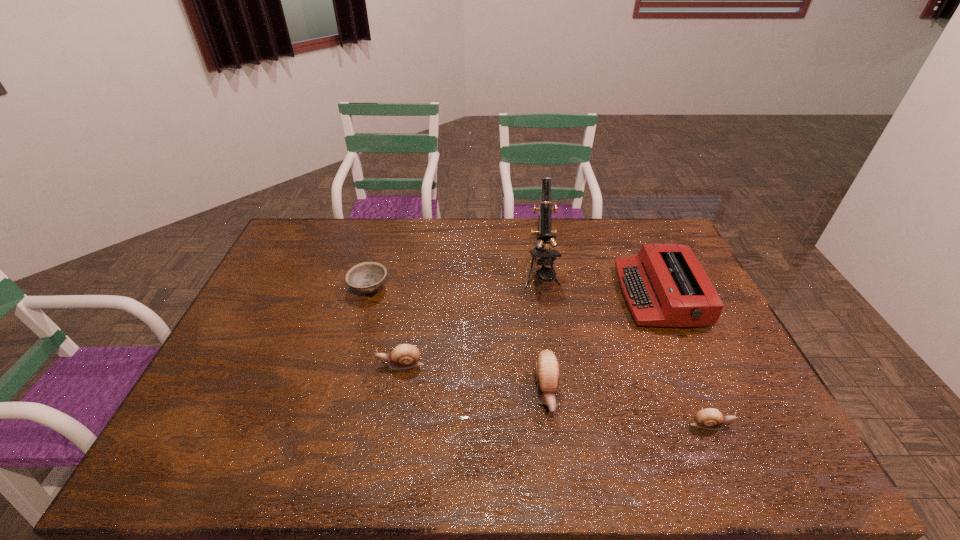
The height and width of the screenshot is (540, 960). Identify the location of free space that satisfies the following two spatial constraints: 1. on the typing side of the typewriter; 2. on the front-facing side of the second escargot from right to left. (703, 393).